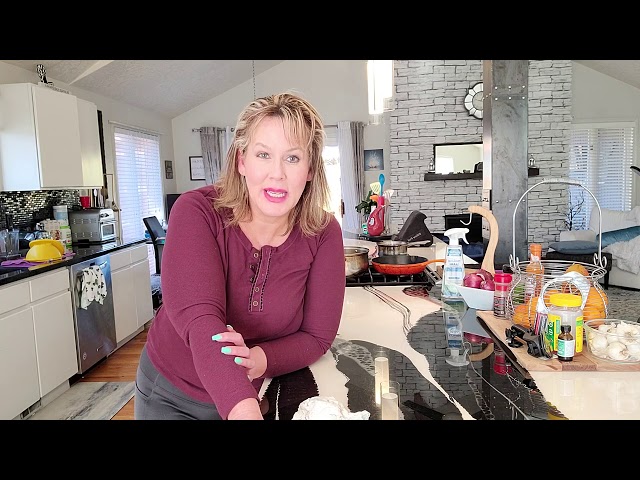
In order to click on yellow bowl in this screenshot , I will do `click(50, 252)`.